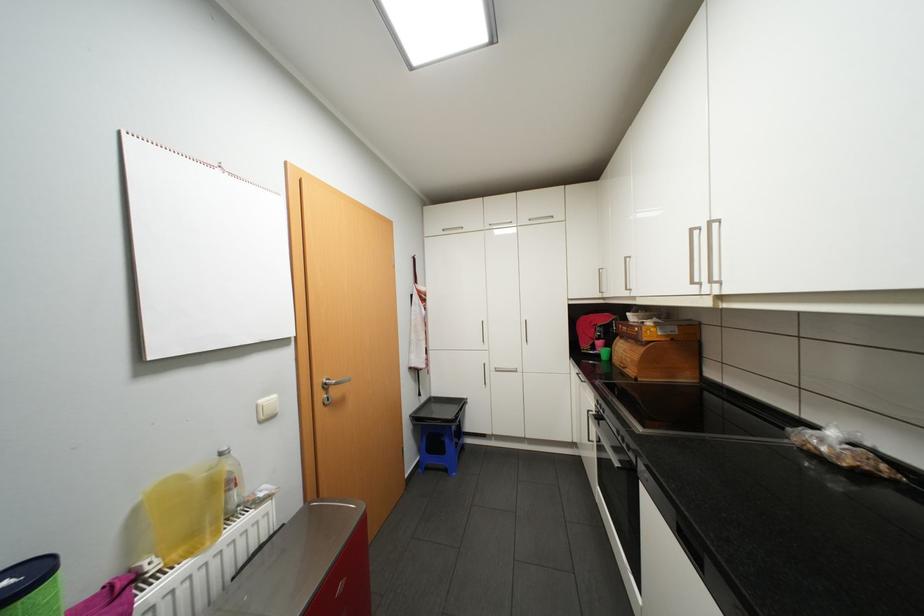
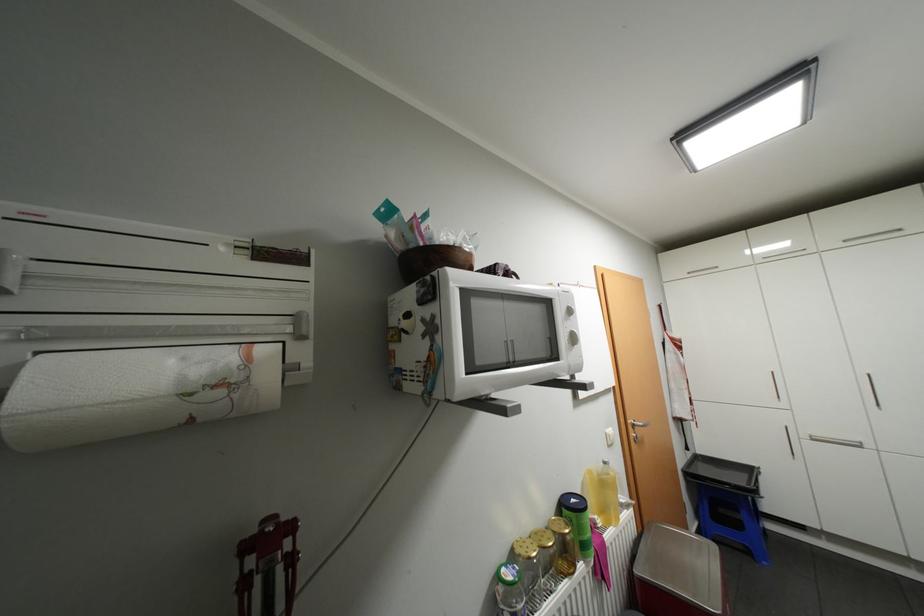
The point at (162, 565) is marked in the first image. Where is the corresponding point in the second image?

(606, 521)